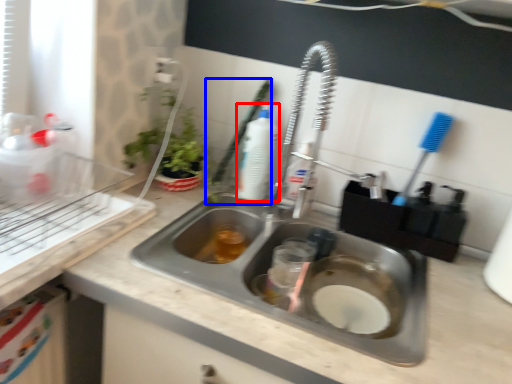
Question: Which object is further to the camera taking this photo, cleaning product (highlighted by a red box) or brush (highlighted by a blue box)?

Choices:
 (A) cleaning product
 (B) brush

Answer: (A)